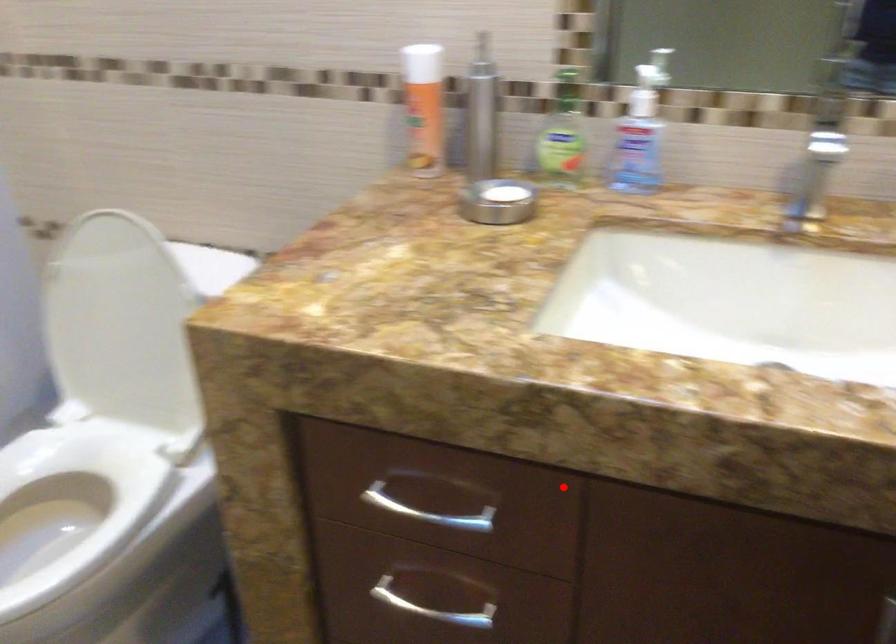
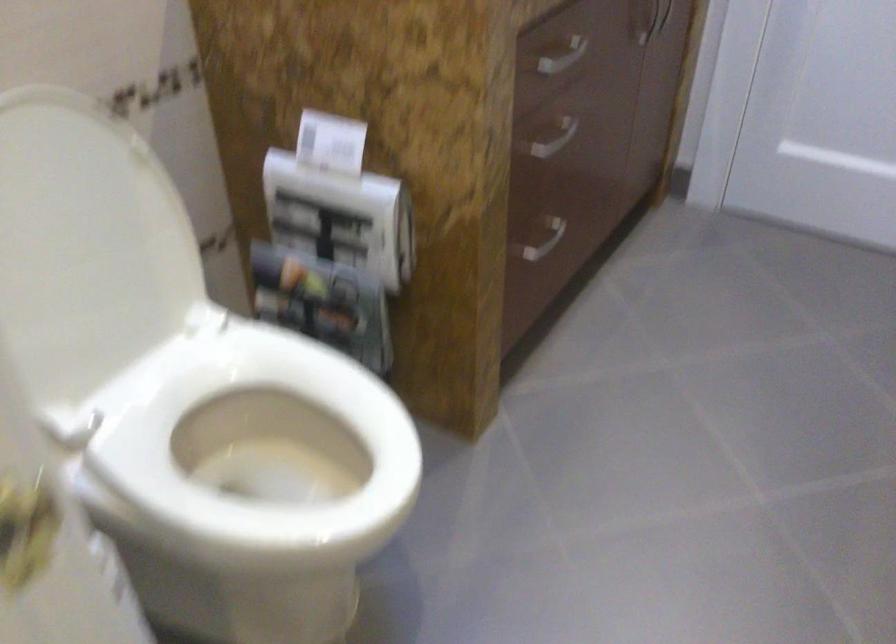
Question: I am providing you with two images of the same scene from different viewpoints. A red point is marked on the first image. Is the red point's position out of view in image 2?

Choices:
 (A) Yes
 (B) No

Answer: (B)